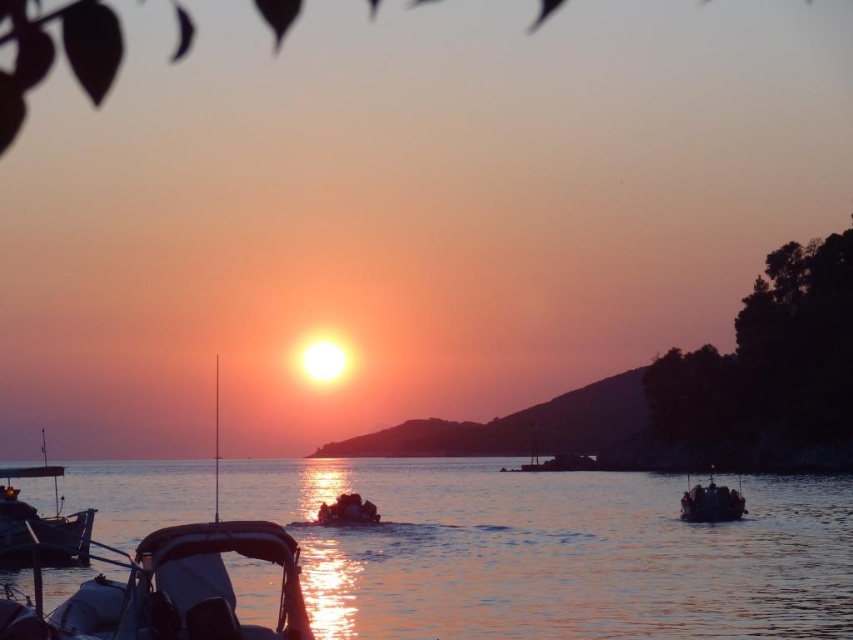
How far apart are white matte boat at center and metallic blue boat at center?

They are 163.10 feet apart.

You are a GUI agent. You are given a task and a screenshot of the screen. Output one action in this format:
    pyautogui.click(x=<x>, y=<y>)
    Task: Click on the white matte boat at center
    
    Given the screenshot: What is the action you would take?
    pyautogui.click(x=167, y=586)

Is matte black boat at lower left shorter than metallic blue boat at center?

Indeed, matte black boat at lower left has a lesser height compared to metallic blue boat at center.

Between matte black boat at lower left and metallic blue boat at center, which one is positioned higher?

matte black boat at lower left is above.

What do you see at coordinates (166, 589) in the screenshot? The height and width of the screenshot is (640, 853). I see `matte black boat at lower left` at bounding box center [166, 589].

Where is `matte black boat at lower left`? This screenshot has height=640, width=853. matte black boat at lower left is located at coordinates (166, 589).

Can you confirm if wooden boat at lower left is shorter than metallic blue boat at center?

Incorrect, wooden boat at lower left's height does not fall short of metallic blue boat at center's.

How distant is wooden boat at lower left from metallic blue boat at center?

wooden boat at lower left is 42.59 meters away from metallic blue boat at center.

Between point (61, 538) and point (712, 472), which one is positioned in front?

Positioned in front is point (61, 538).

You are a GUI agent. You are given a task and a screenshot of the screen. Output one action in this format:
    pyautogui.click(x=<x>, y=<y>)
    Task: Click on the wooden boat at lower left
    Image resolution: width=853 pixels, height=640 pixels.
    Given the screenshot: What is the action you would take?
    pyautogui.click(x=39, y=524)